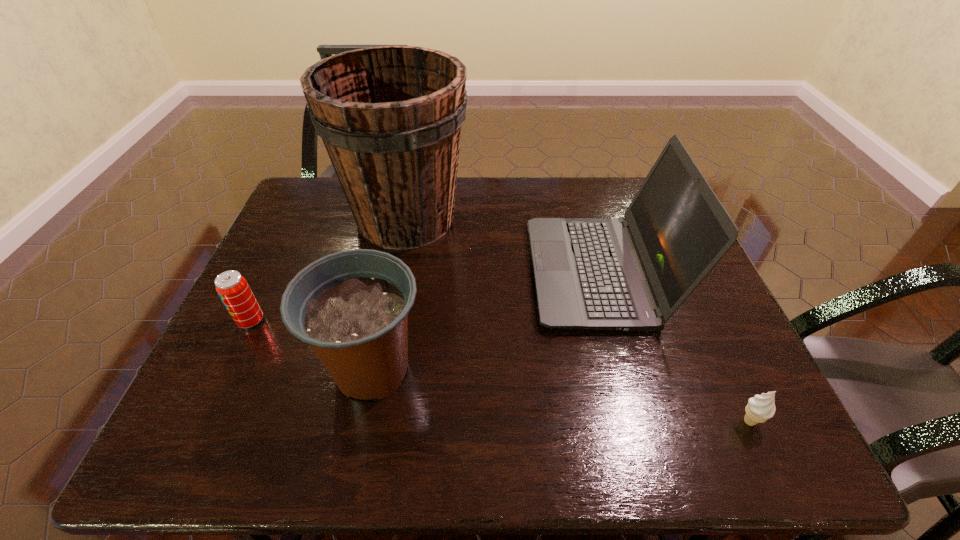
At what (x,y) coordinates should I click in order to perform the action: click on vacant space that's between the rightmost object and the third shortest object. Please return your answer as a coordinate pair (x, y). Image resolution: width=960 pixels, height=540 pixels. Looking at the image, I should click on (561, 395).

Locate an element on the screen. free space between the laptop_computer and the shortest object is located at coordinates (674, 347).

Where is `unoccupied area between the bucket and the fourth shortest object`? The height and width of the screenshot is (540, 960). unoccupied area between the bucket and the fourth shortest object is located at coordinates (502, 246).

This screenshot has width=960, height=540. I want to click on empty space between the tallest object and the laptop_computer, so click(502, 246).

I want to click on free space between the rightmost object and the soda can, so click(x=500, y=371).

Locate which object is the second closest to the bucket. Please provide its 2D coordinates. Your answer should be formatted as a tuple, i.e. [(x, y)], where the tuple contains the x and y coordinates of a point satisfying the conditions above.

[(233, 289)]

Select which object is the third closest to the second object from right to left. Please provide its 2D coordinates. Your answer should be formatted as a tuple, i.e. [(x, y)], where the tuple contains the x and y coordinates of a point satisfying the conditions above.

[(352, 307)]